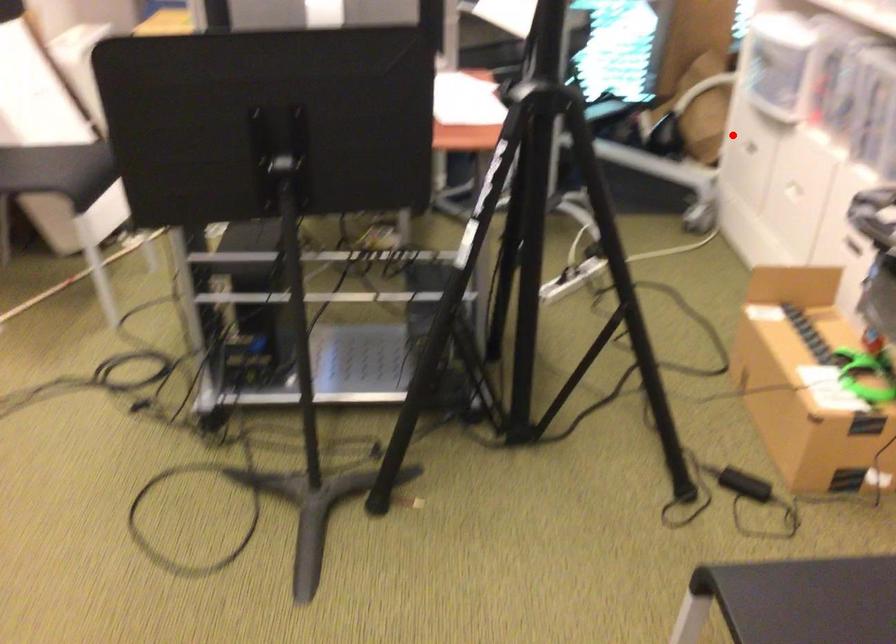
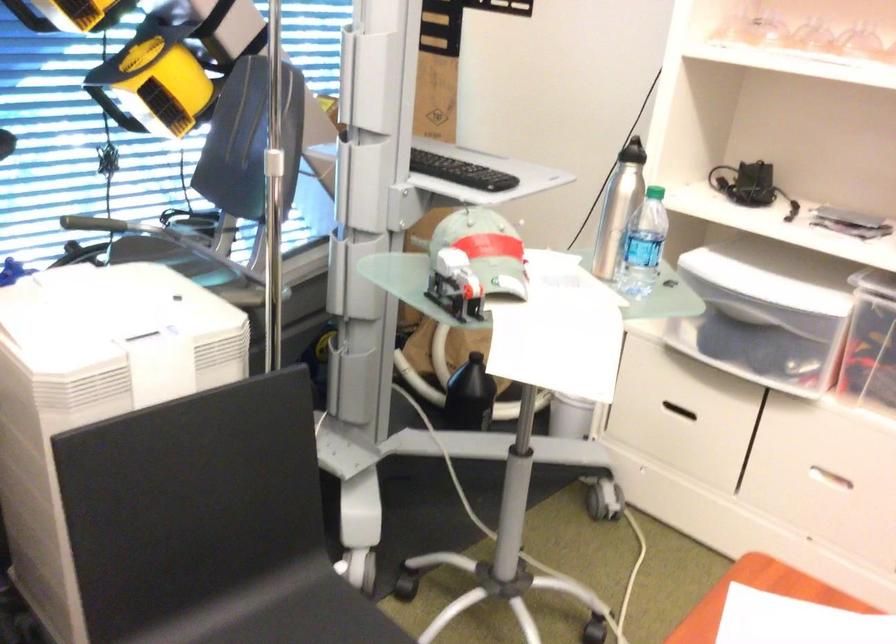
Question: I am providing you with two images of the same scene from different viewpoints. A red point is shown in image1. For the corresponding object point in image2, is it positioned nearer or farther from the camera?

Choices:
 (A) Nearer
 (B) Farther

Answer: (A)